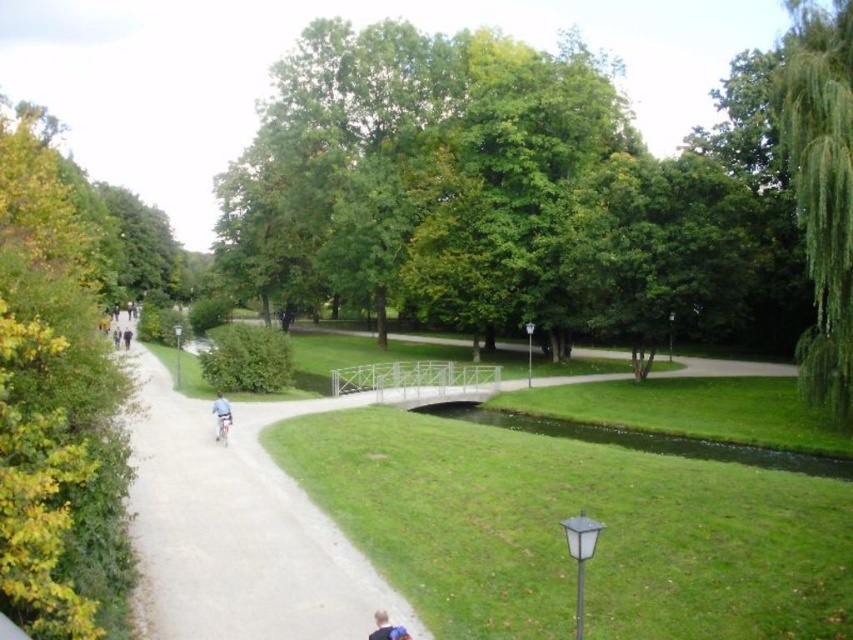
Question: Can you confirm if gray gravel path at left is thinner than green leafy tree at upper right?

Choices:
 (A) yes
 (B) no

Answer: (A)

Question: Which point appears closest to the camera in this image?

Choices:
 (A) (224, 401)
 (B) (837, 284)

Answer: (A)

Question: Is green leafy tree at left to the left of light blue metallic bicycle at center from the viewer's perspective?

Choices:
 (A) yes
 (B) no

Answer: (A)

Question: Estimate the real-world distances between objects in this image. Which object is farther from the green leafy tree at left?

Choices:
 (A) green leafy tree at center
 (B) gray gravel path at left
 (C) light blue metallic bicycle at center
 (D) blue fabric shirt at center

Answer: (A)

Question: Which of the following is the farthest from the observer?

Choices:
 (A) (671, 170)
 (B) (47, 163)
 (C) (222, 403)
 (D) (229, 413)

Answer: (A)

Question: Does green leafy tree at center appear under gray gravel path at left?

Choices:
 (A) no
 (B) yes

Answer: (A)